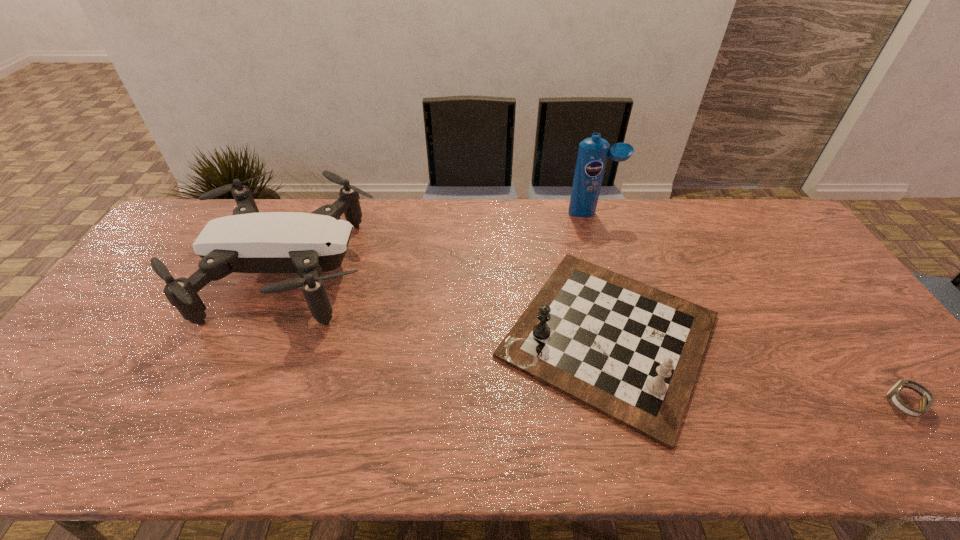
The height and width of the screenshot is (540, 960). Identify the location of free space that satisfies the following two spatial constraints: 1. on the camera side of the third shortest object; 2. on the right side of the second shortest object. (263, 336).

I want to click on free space that satisfies the following two spatial constraints: 1. on the camera side of the gameboard; 2. on the right side of the drone, so click(263, 336).

Identify the location of free spot that satisfies the following two spatial constraints: 1. on the back side of the tallest object; 2. on the right side of the second shortest object. (577, 213).